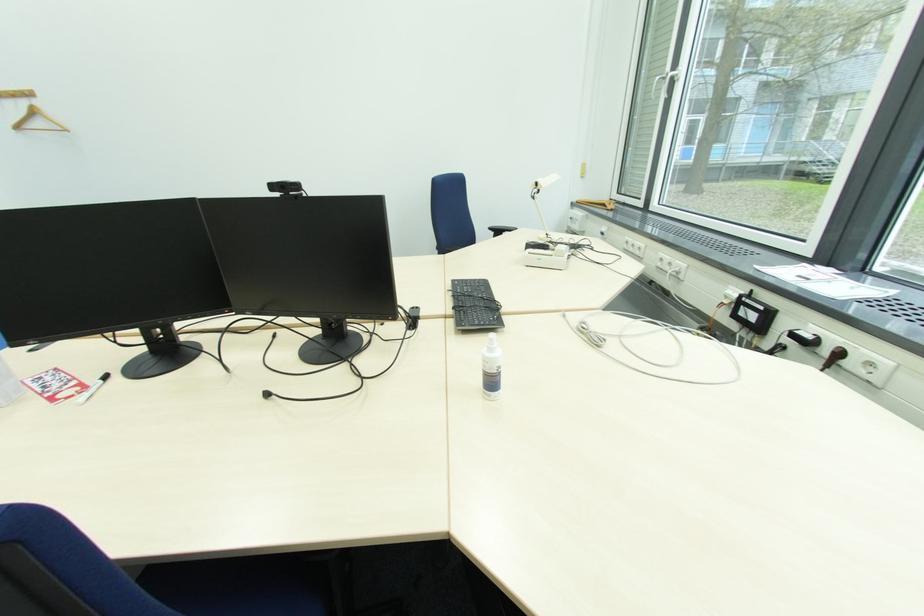
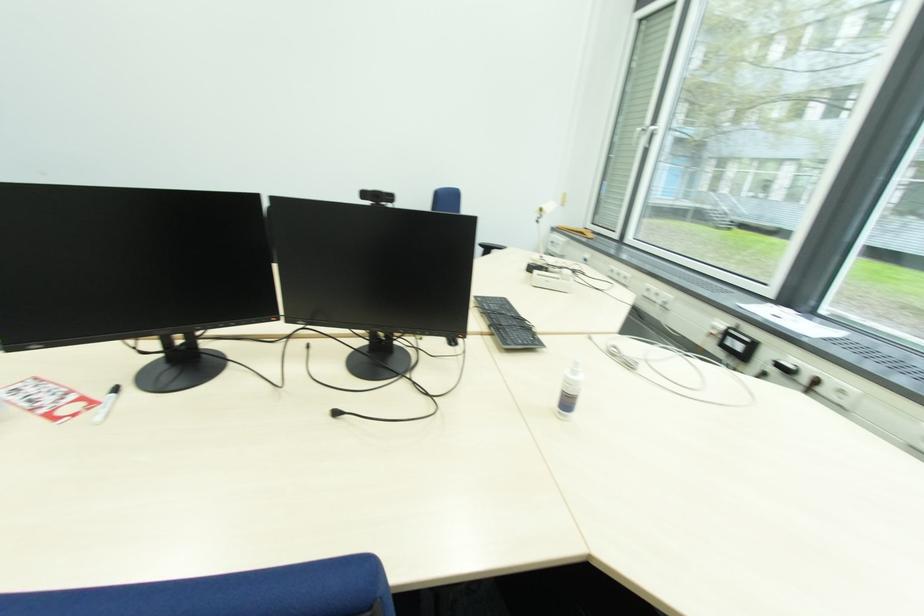
Question: The first image is from the beginning of the video and the second image is from the end. How did the camera likely rotate when shooting the video?

Choices:
 (A) Left
 (B) Right
 (C) Up
 (D) Down

Answer: (B)